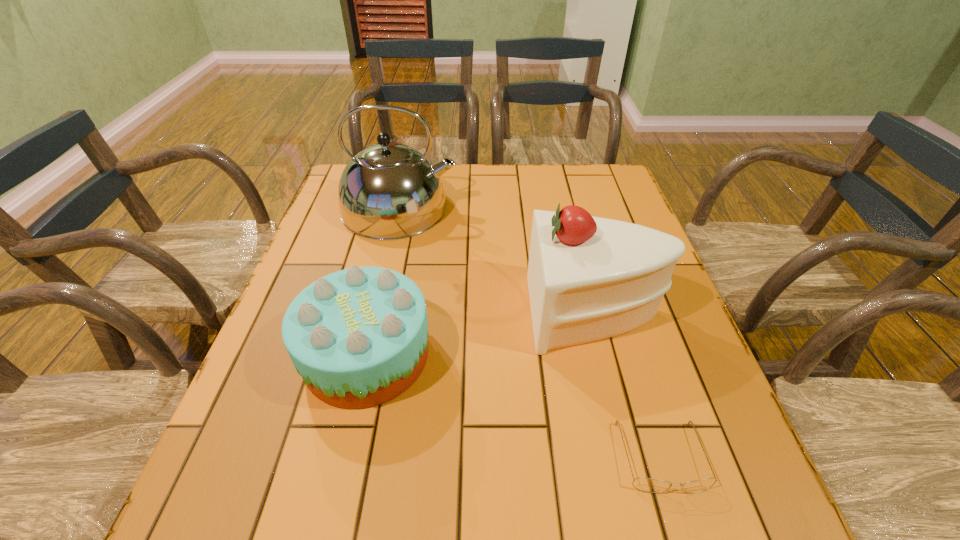
Find the location of `the farthest object`. the farthest object is located at coordinates (388, 191).

Where is `the right cake`? This screenshot has height=540, width=960. the right cake is located at coordinates (589, 278).

The image size is (960, 540). Identify the location of the second shortest object. (358, 337).

Find the location of a particular element. The image size is (960, 540). the left cake is located at coordinates (358, 337).

Image resolution: width=960 pixels, height=540 pixels. I want to click on spectacles, so click(644, 484).

The height and width of the screenshot is (540, 960). Identify the location of the shortest object. (644, 484).

Identify the location of vacant region located from the spout of the farthest object. The height and width of the screenshot is (540, 960). (540, 208).

Image resolution: width=960 pixels, height=540 pixels. I want to click on vacant region located 0.340m on the front of the taller cake, so click(x=652, y=534).

In order to click on vacant region located 0.210m on the back of the left cake in this screenshot , I will do `click(391, 251)`.

Where is `object located in the far edge section of the desktop`? This screenshot has height=540, width=960. object located in the far edge section of the desktop is located at coordinates (388, 191).